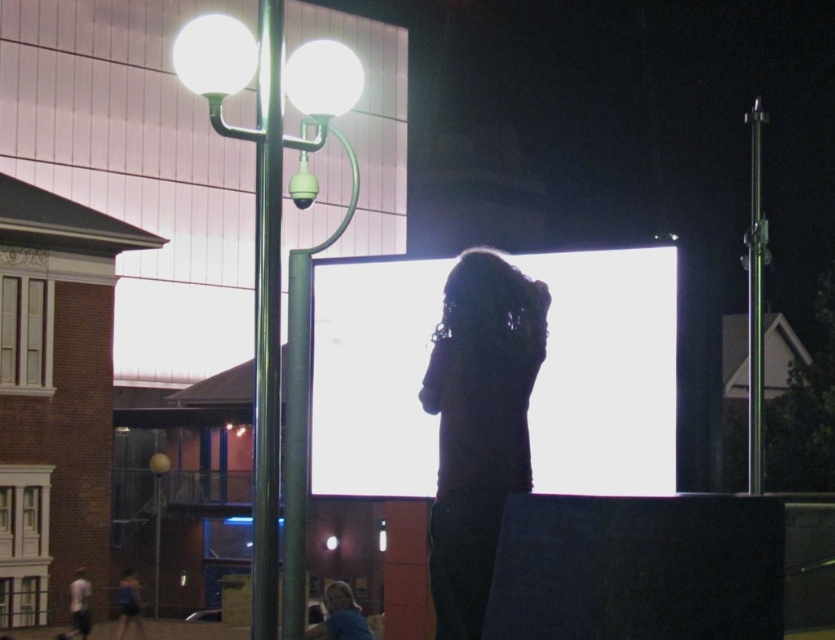
Question: Which is farther from the blue fabric shirt at center?

Choices:
 (A) metallic pole at center-left
 (B) metallic pole at right

Answer: (B)

Question: Can you confirm if white glossy projection screen at center is bigger than dark matte hair at center?

Choices:
 (A) no
 (B) yes

Answer: (B)

Question: Is metallic pole at right further to the viewer compared to blue fabric shirt at center?

Choices:
 (A) no
 (B) yes

Answer: (A)

Question: Considering the relative positions of metallic pole at center and blue fabric shirt at center in the image provided, where is metallic pole at center located with respect to blue fabric shirt at center?

Choices:
 (A) above
 (B) below

Answer: (A)

Question: Which point is closer to the camera taking this photo?

Choices:
 (A) (325, 602)
 (B) (281, 172)

Answer: (B)

Question: Which of these objects is positioned farthest from the dark matte hair at center?

Choices:
 (A) white glossy projection screen at center
 (B) metallic pole at center

Answer: (A)